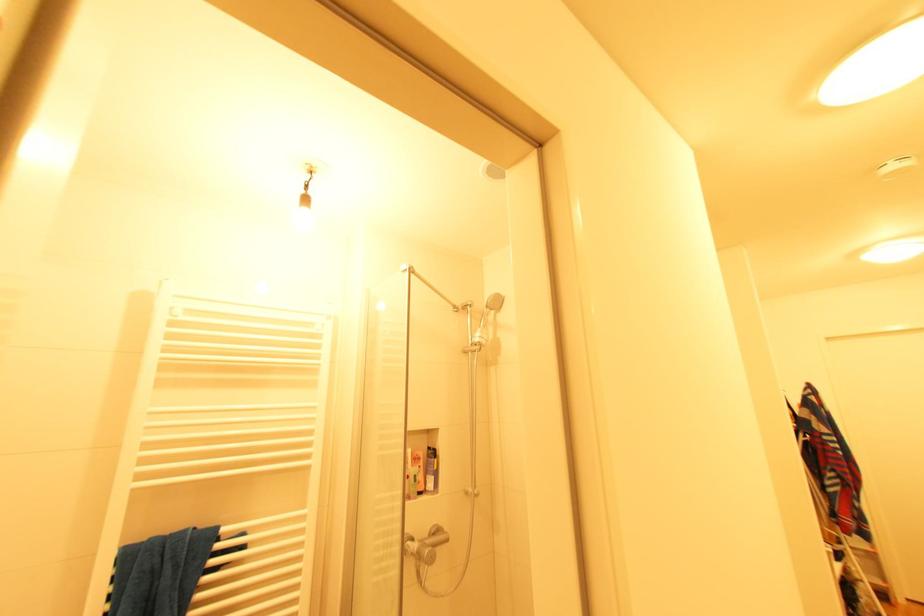
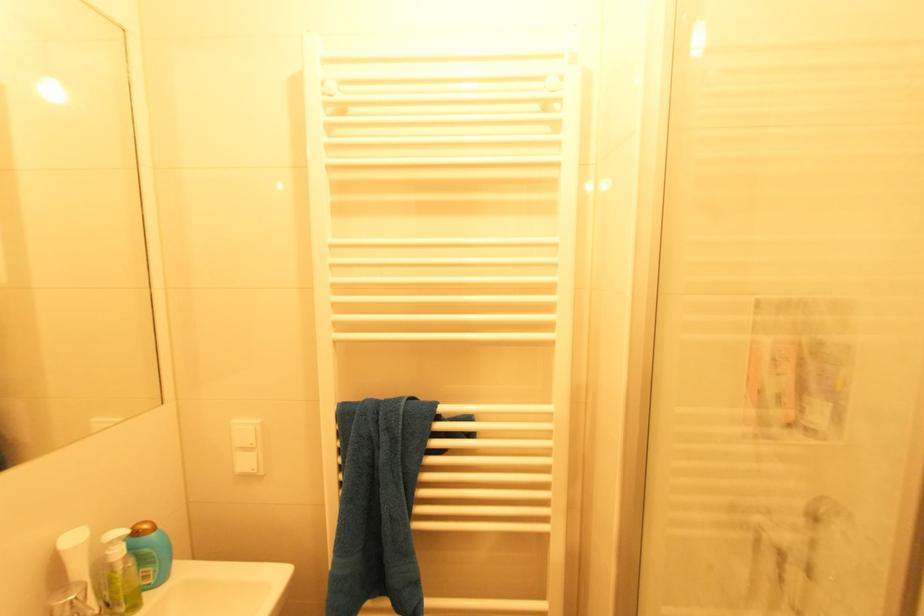
Based on the continuous images, in which direction is the camera rotating?

The camera's rotation is toward left-down.